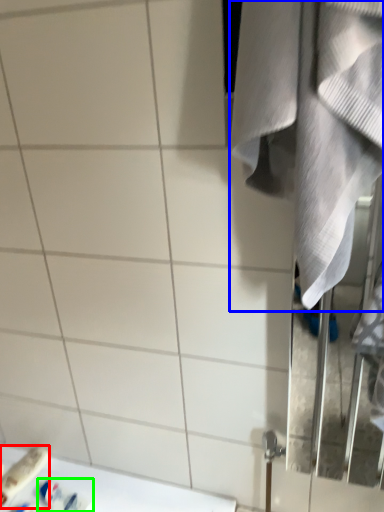
Question: Which is nearer to the toiletry (highlighted by a red box)? towel (highlighted by a blue box) or toiletry (highlighted by a green box).

Choices:
 (A) towel
 (B) toiletry

Answer: (B)